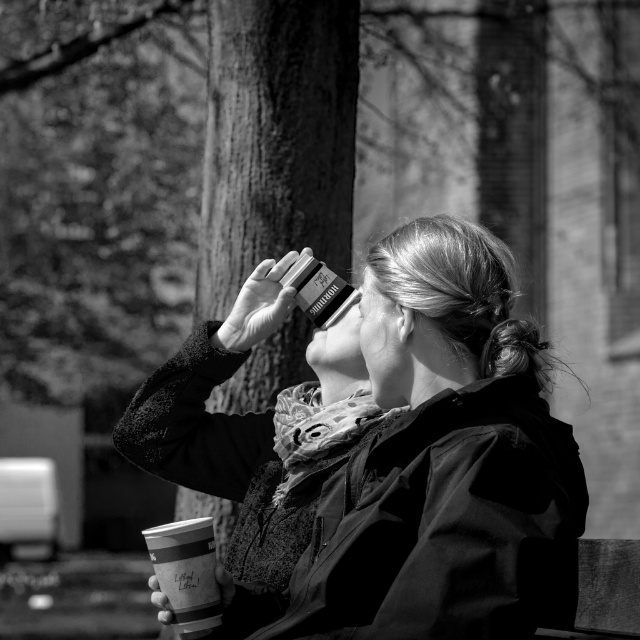
Does matte black jacket at center come in front of smooth bark tree at center?

Yes, matte black jacket at center is in front of smooth bark tree at center.

Can you confirm if matte black jacket at center is wider than smooth bark tree at center?

Yes, matte black jacket at center is wider than smooth bark tree at center.

Is point (477, 388) positioned before point (305, 340)?

Yes, point (477, 388) is closer to viewer.

Locate an element on the screen. matte black jacket at center is located at coordinates (435, 464).

Which is above, smooth bark tree at center or paper cup at lower left?

smooth bark tree at center is higher up.

Does smooth bark tree at center appear under paper cup at lower left?

No.

Is point (333, 236) positioned before point (189, 556)?

That is False.

The image size is (640, 640). What are the coordinates of `smooth bark tree at center` in the screenshot? It's located at (275, 138).

Does point (404, 246) lie in front of point (180, 573)?

No, (404, 246) is further to viewer.

Where is `matte black jacket at center`? The image size is (640, 640). matte black jacket at center is located at coordinates (435, 464).

Who is more forward, (x=424, y=481) or (x=200, y=611)?

Point (x=424, y=481) is more forward.

Locate an element on the screen. This screenshot has width=640, height=640. matte black jacket at center is located at coordinates (435, 464).